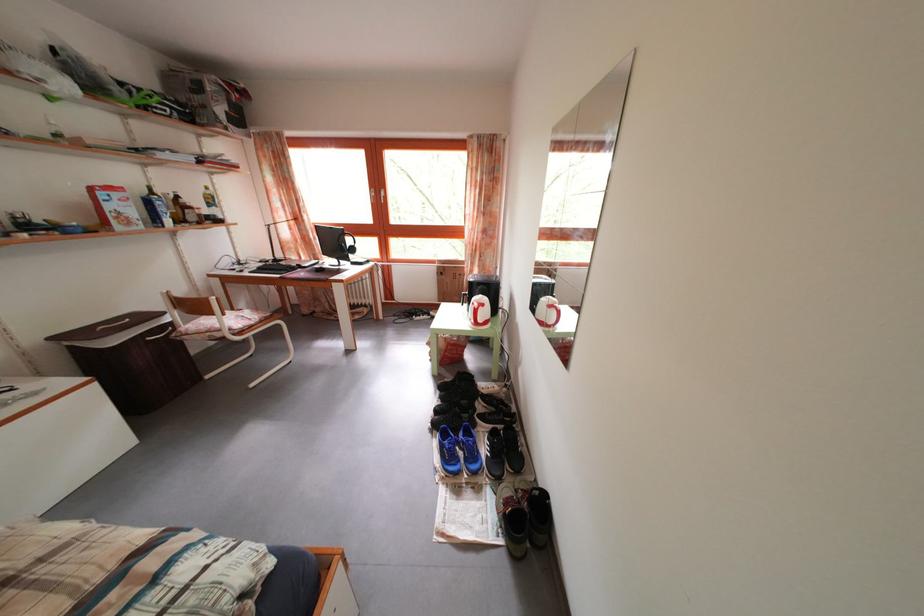
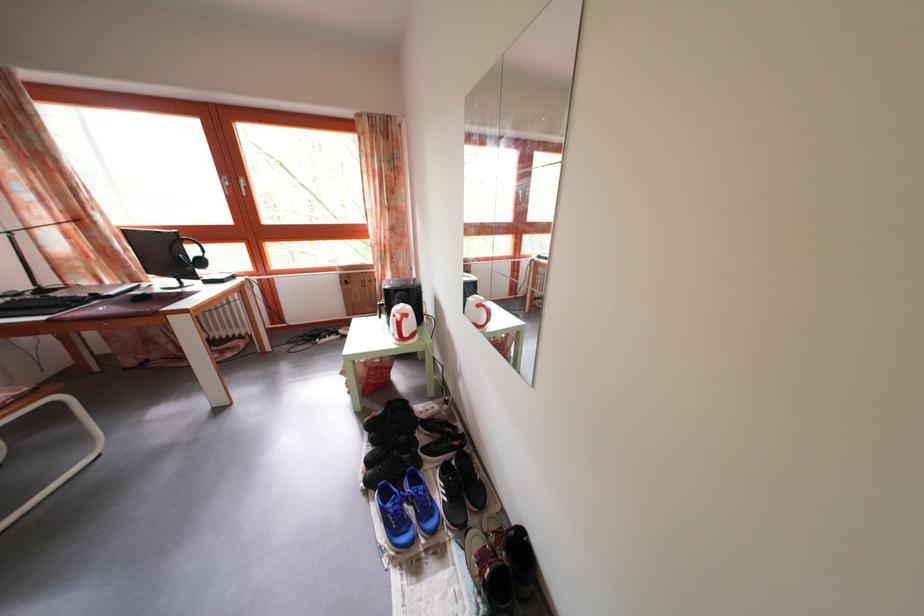
Question: Which direction would the cameraman need to move to produce the second image? Reply with the corresponding letter.

Choices:
 (A) Left
 (B) Right
 (C) Forward
 (D) Backward

Answer: (C)